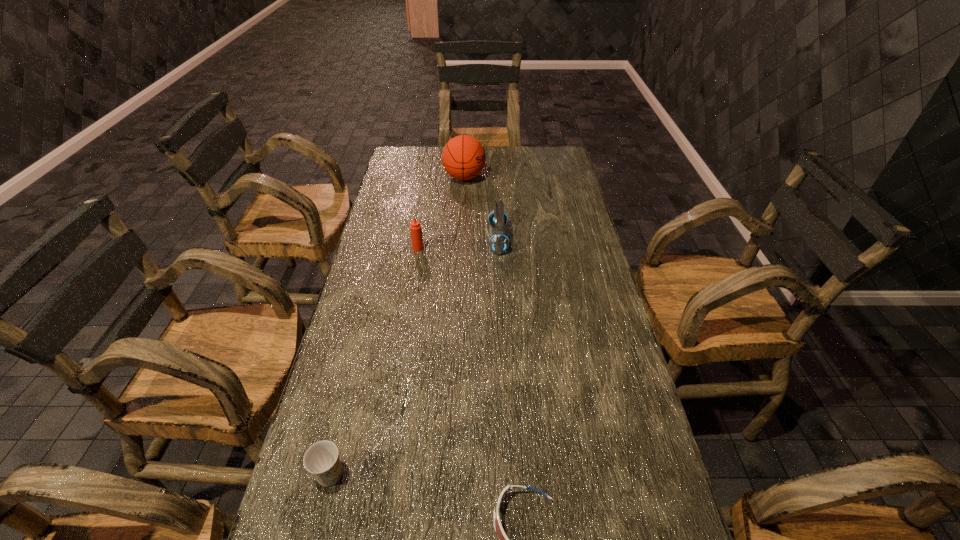
This screenshot has width=960, height=540. In order to click on vacant area that lies between the leftmost object and the second object from left to right in this screenshot , I will do `click(374, 361)`.

Where is `vacant space that's between the farthest object and the headset`? The width and height of the screenshot is (960, 540). vacant space that's between the farthest object and the headset is located at coordinates (481, 208).

At what (x,y) coordinates should I click in order to perform the action: click on free spot between the headset and the Tabasco sauce. Please return your answer as a coordinate pair (x, y). Looking at the image, I should click on (458, 244).

Where is `vacant area between the second shortest object and the basketball`? The height and width of the screenshot is (540, 960). vacant area between the second shortest object and the basketball is located at coordinates (397, 326).

You are a GUI agent. You are given a task and a screenshot of the screen. Output one action in this format:
    pyautogui.click(x=<x>, y=<y>)
    Task: Click on the vacant region between the headset and the farthest object
    The image size is (960, 540).
    Given the screenshot: What is the action you would take?
    pyautogui.click(x=481, y=208)

Identify which object is the second nearest to the shortest object. Please provide its 2D coordinates. Your answer should be formatted as a tuple, i.e. [(x, y)], where the tuple contains the x and y coordinates of a point satisfying the conditions above.

[(498, 243)]

The height and width of the screenshot is (540, 960). Find the location of `object that is the fourth closest one to the Tabasco sauce`. object that is the fourth closest one to the Tabasco sauce is located at coordinates (503, 539).

You are a GUI agent. You are given a task and a screenshot of the screen. Output one action in this format:
    pyautogui.click(x=<x>, y=<y>)
    Task: Click on the free space that satisfies the following two spatial constraints: 1. on the ear cups of the headset; 2. on the front side of the fourth object from right to left
    The width and height of the screenshot is (960, 540).
    Given the screenshot: What is the action you would take?
    pyautogui.click(x=498, y=248)